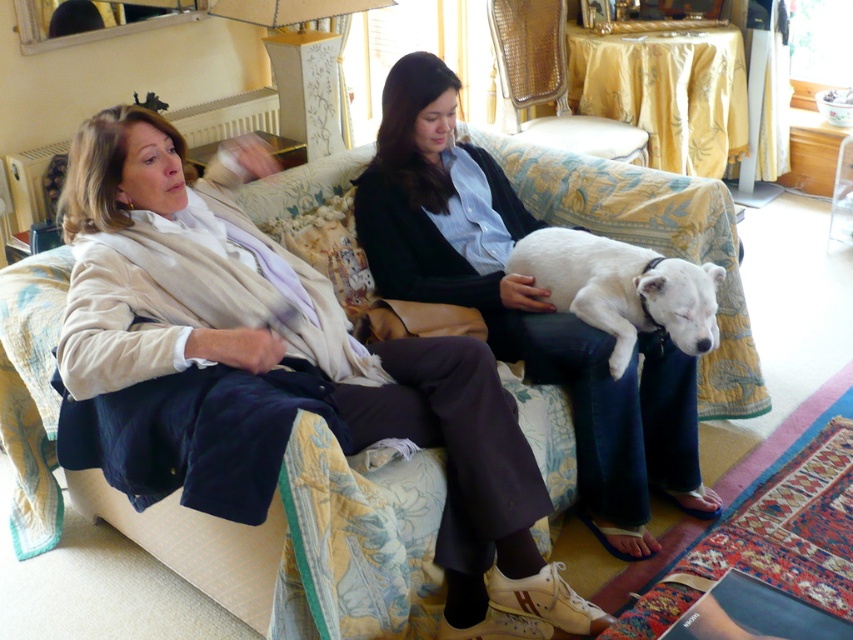
Is matte black jacket at center positioned behind woven cane chair at upper center?

No, matte black jacket at center is in front of woven cane chair at upper center.

Looking at this image, between matte black jacket at center and woven cane chair at upper center, which one appears on the left side from the viewer's perspective?

Positioned to the left is matte black jacket at center.

Find the location of a particular element. matte black jacket at center is located at coordinates (523, 307).

Where is `matte black jacket at center`? This screenshot has height=640, width=853. matte black jacket at center is located at coordinates (523, 307).

In the scene shown: Who is more distant from viewer, [476,300] or [607,241]?

Point [476,300]

Is the position of matte black jacket at center less distant than that of white fur dog at center?

No, it is not.

You are a GUI agent. You are given a task and a screenshot of the screen. Output one action in this format:
    pyautogui.click(x=<x>, y=<y>)
    Task: Click on the matte black jacket at center
    Image resolution: width=853 pixels, height=640 pixels.
    Given the screenshot: What is the action you would take?
    pyautogui.click(x=523, y=307)

Can you confirm if white fur dog at center is bigger than woven cane chair at upper center?

No.

Who is more forward, (689, 337) or (497, 51)?

Point (689, 337) is more forward.

This screenshot has height=640, width=853. In order to click on white fur dog at center in this screenshot , I will do `click(621, 289)`.